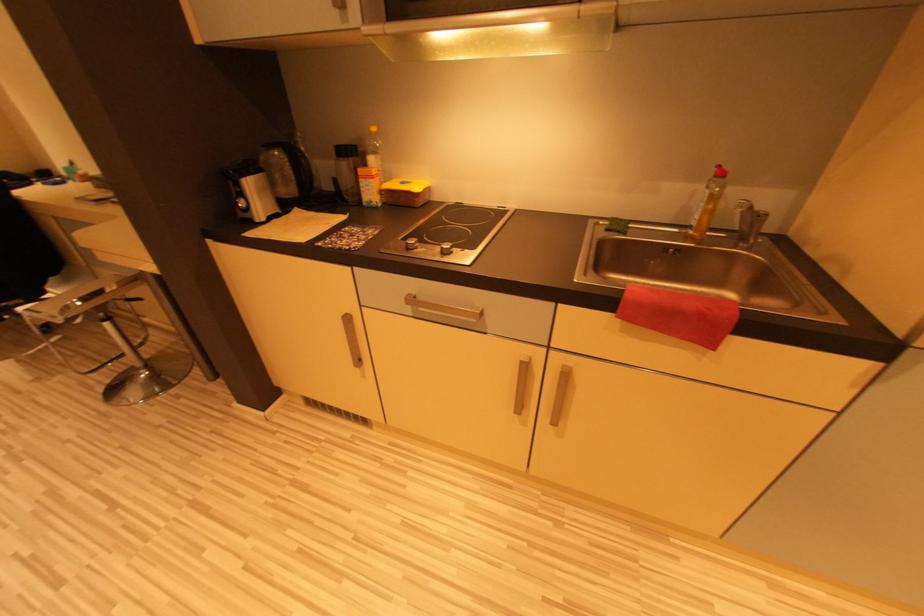
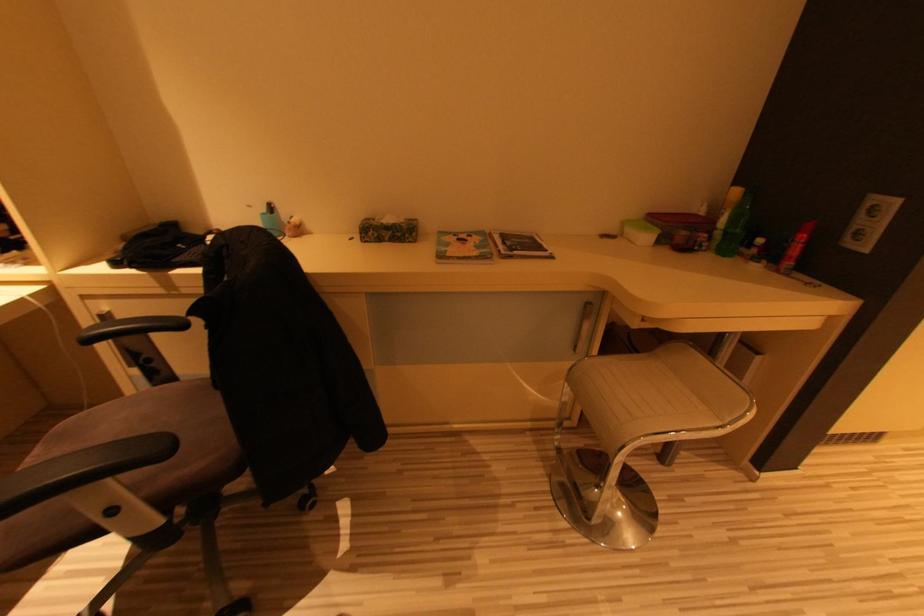
Question: In a continuous first-person perspective shot, in which direction is the camera moving?

Choices:
 (A) Left
 (B) Right
 (C) Forward
 (D) Backward

Answer: (A)